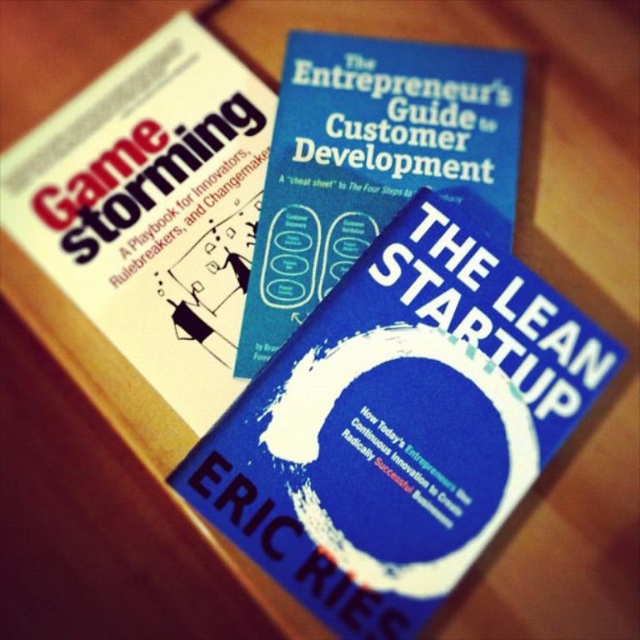
Question: Is white paper book cover at upper left smaller than blue matte book at center?

Choices:
 (A) no
 (B) yes

Answer: (A)

Question: Can you confirm if white paper book cover at upper left is smaller than blue matte book at center?

Choices:
 (A) yes
 (B) no

Answer: (B)

Question: Among these points, which one is nearest to the camera?

Choices:
 (A) (243, 161)
 (B) (381, 150)

Answer: (B)

Question: Does white paper book cover at upper left have a lesser width compared to blue matte book at center?

Choices:
 (A) no
 (B) yes

Answer: (B)

Question: Which of the following is the closest to the observer?

Choices:
 (A) blue matte book at center
 (B) white paper book cover at upper left

Answer: (B)